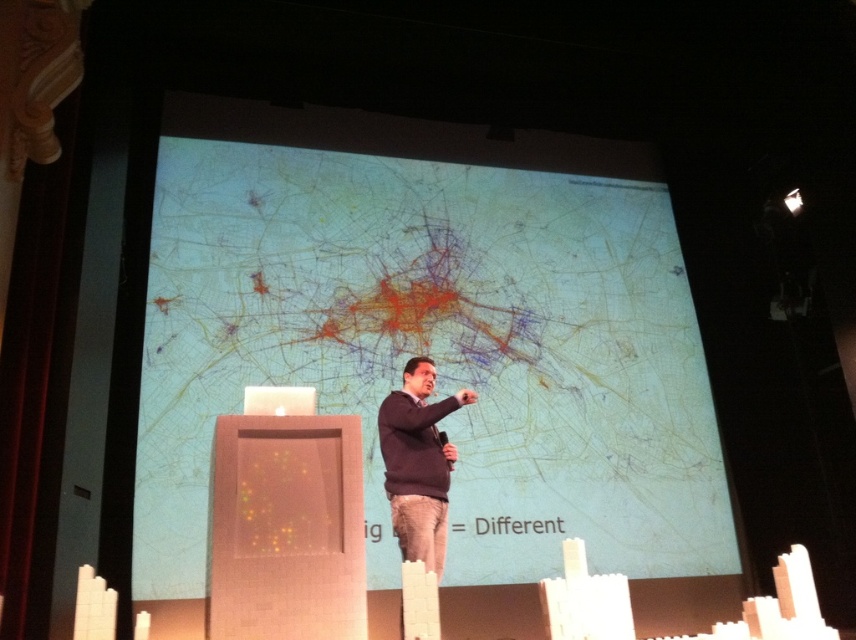
Is point (336, 328) closer to viewer compared to point (396, 490)?

No, (336, 328) is further to viewer.

Find the location of `matte plastic projection screen at center`. matte plastic projection screen at center is located at coordinates [431, 333].

Identify the location of matte plastic projection screen at center. (431, 333).